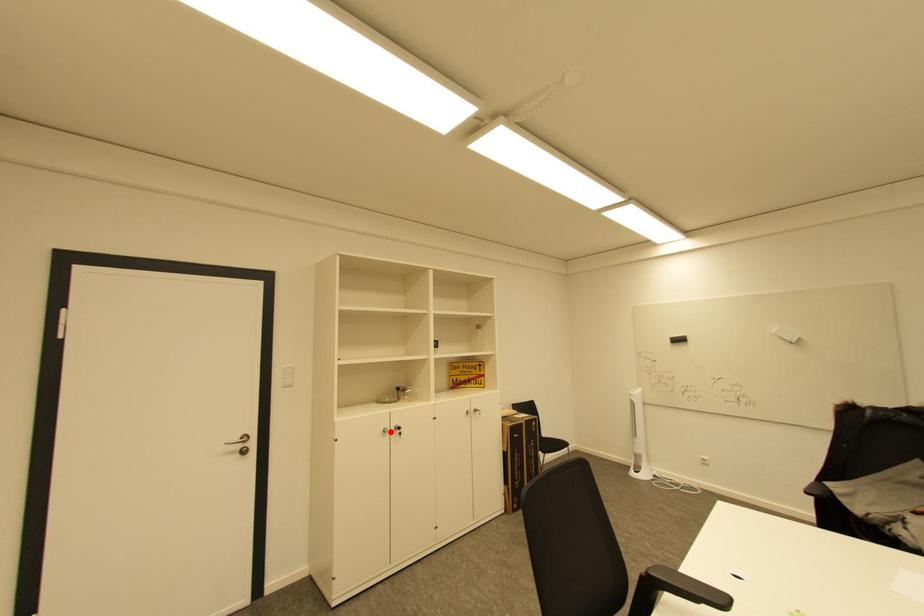
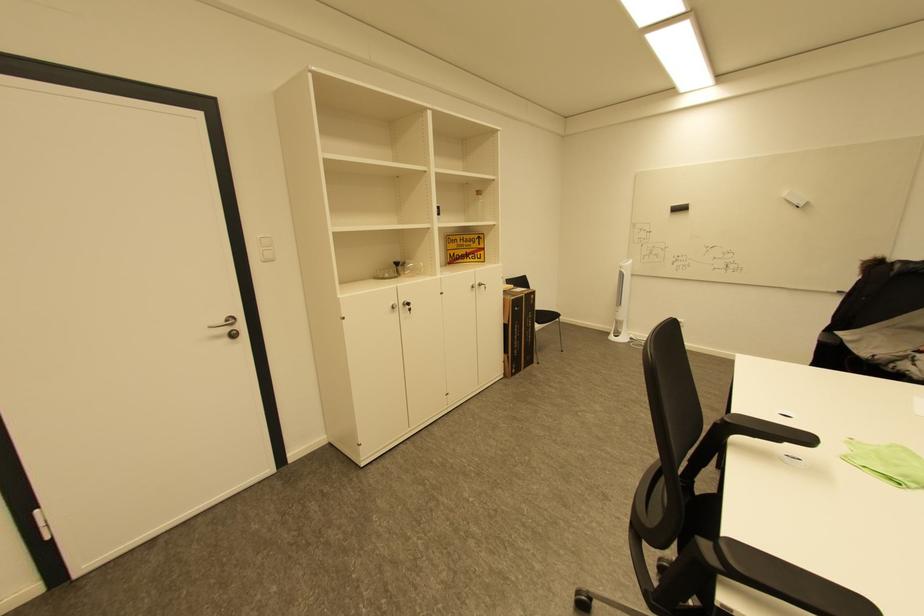
Question: I am providing you with two images of the same scene from different viewpoints. Image1 has a red point marked. In image2, the corresponding 3D location appears at what relative position? Reply with the corresponding letter.

Choices:
 (A) Closer
 (B) Farther

Answer: (A)